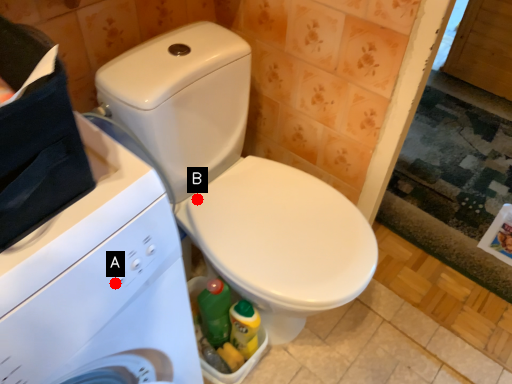
Question: Two points are circled on the image, labeled by A and B beside each circle. Among these points, which one is farthest from the camera?

Choices:
 (A) A is further
 (B) B is further

Answer: (B)